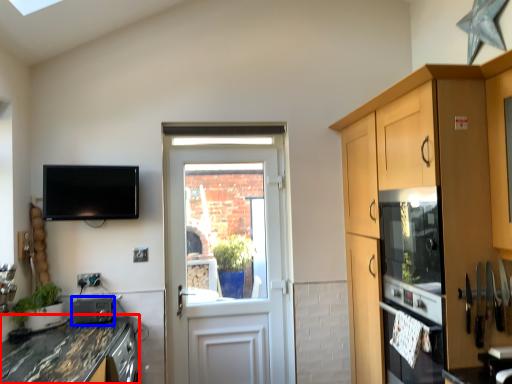
Question: Which point is further to the camera, countertop (highlighted by a red box) or appliance (highlighted by a blue box)?

Choices:
 (A) countertop
 (B) appliance

Answer: (B)